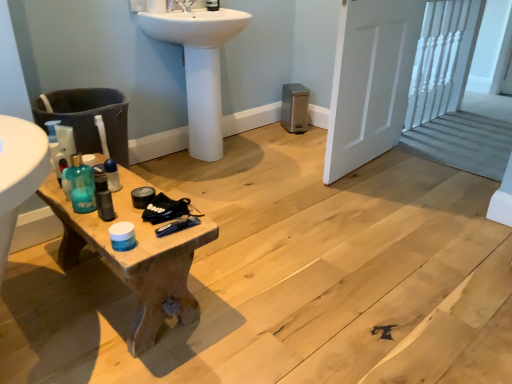
Where is `free location in front of translucent plastic bottle at center, which appears as the 2th toiletry when viewed from the right`? The width and height of the screenshot is (512, 384). free location in front of translucent plastic bottle at center, which appears as the 2th toiletry when viewed from the right is located at coordinates (114, 208).